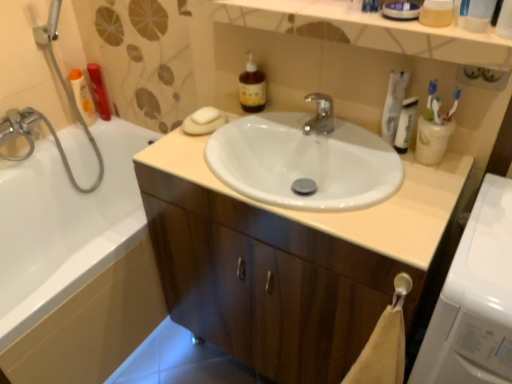
Where is `free space that is in between white matte soap at upper center and white glossy tube at upper right`? Image resolution: width=512 pixels, height=384 pixels. free space that is in between white matte soap at upper center and white glossy tube at upper right is located at coordinates (296, 134).